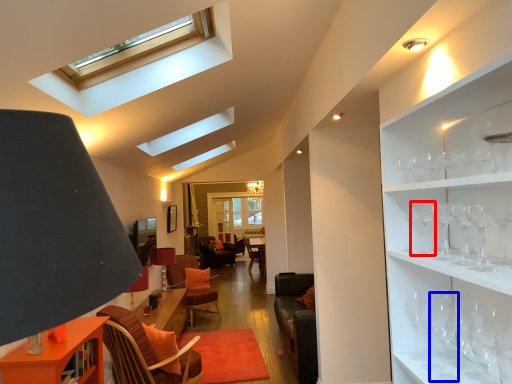
Question: Which of the following is the farthest to the observer, wine glass (highlighted by a red box) or wine glass (highlighted by a blue box)?

Choices:
 (A) wine glass
 (B) wine glass

Answer: (A)